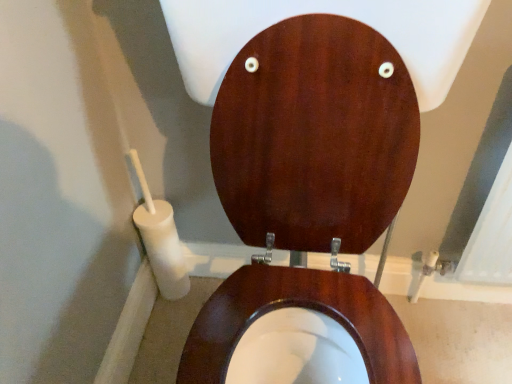
This screenshot has height=384, width=512. What do you see at coordinates (298, 305) in the screenshot?
I see `glossy wood toilet bowl at center` at bounding box center [298, 305].

Where is `glossy wood toilet bowl at center`? The image size is (512, 384). glossy wood toilet bowl at center is located at coordinates (298, 305).

Identify the location of glossy wood toilet bowl at center. The height and width of the screenshot is (384, 512). (298, 305).